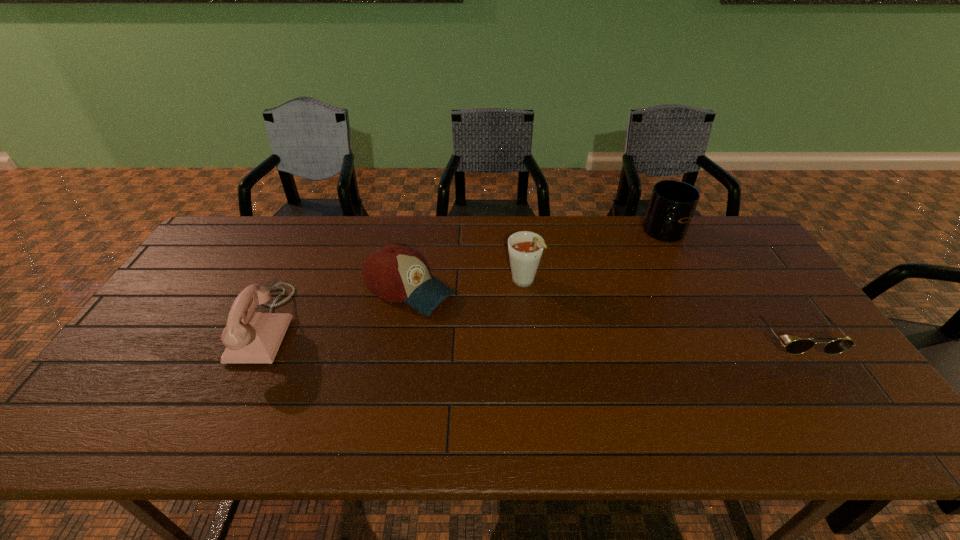
Locate an element on the screen. telephone is located at coordinates (250, 337).

The width and height of the screenshot is (960, 540). Find the location of `the rightmost object`. the rightmost object is located at coordinates (799, 346).

You are a GUI agent. You are given a task and a screenshot of the screen. Output one action in this format:
    pyautogui.click(x=<x>, y=<y>)
    Task: Click on the sunglasses
    
    Given the screenshot: What is the action you would take?
    pyautogui.click(x=799, y=346)

In order to click on mug in this screenshot , I will do `click(672, 205)`.

This screenshot has height=540, width=960. What are the coordinates of `the farthest object` in the screenshot? It's located at pos(672,205).

The height and width of the screenshot is (540, 960). In order to click on baseball cap in this screenshot , I will do `click(395, 273)`.

Identify the location of the second object from left to right. This screenshot has height=540, width=960. (395, 273).

At what (x,y) coordinates should I click in order to perform the action: click on root beer. Please return your answer as a coordinate pair (x, y). The height and width of the screenshot is (540, 960). Looking at the image, I should click on (525, 248).

At what (x,y) coordinates should I click in order to perform the action: click on the tallest object. Please return your answer as a coordinate pair (x, y). The width and height of the screenshot is (960, 540). Looking at the image, I should click on (525, 248).

At what (x,y) coordinates should I click in order to perform the action: click on vacant space located 0.210m on the dial of the telephone. Please return your answer as a coordinate pair (x, y). The height and width of the screenshot is (540, 960). Looking at the image, I should click on (165, 325).